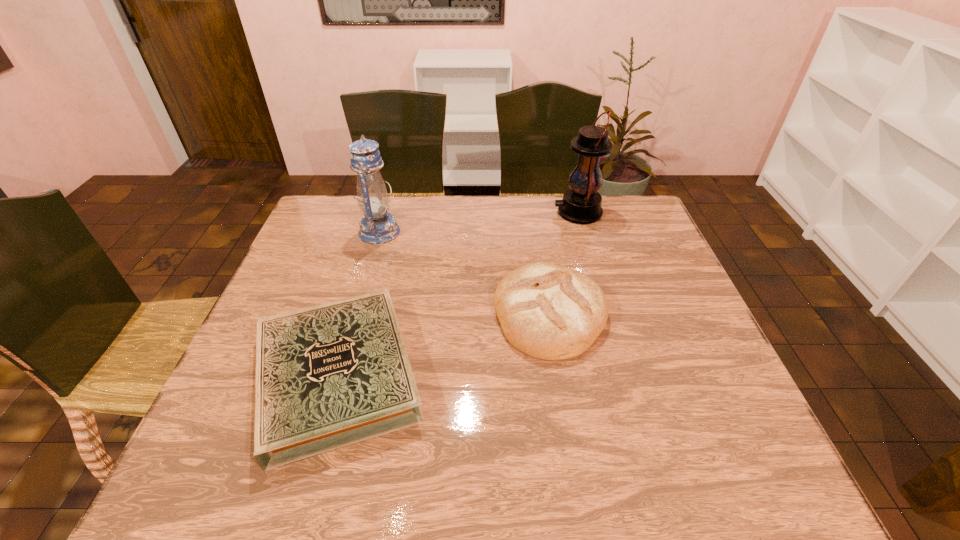
Identify the location of object that stands as the third closest to the left lantern. (581, 204).

Identify which object is located as the third nearest to the bread. Please provide its 2D coordinates. Your answer should be formatted as a tuple, i.e. [(x, y)], where the tuple contains the x and y coordinates of a point satisfying the conditions above.

[(377, 226)]

This screenshot has height=540, width=960. In order to click on blank space that satisfies the following two spatial constraints: 1. above the right lantern, indicating its light source; 2. on the front side of the hardback book in this screenshot , I will do `click(626, 375)`.

The width and height of the screenshot is (960, 540). Find the location of `blank area in the image that satisfies the following two spatial constraints: 1. on the front-facing side of the bread; 2. on the left side of the left lantern`. blank area in the image that satisfies the following two spatial constraints: 1. on the front-facing side of the bread; 2. on the left side of the left lantern is located at coordinates 356,314.